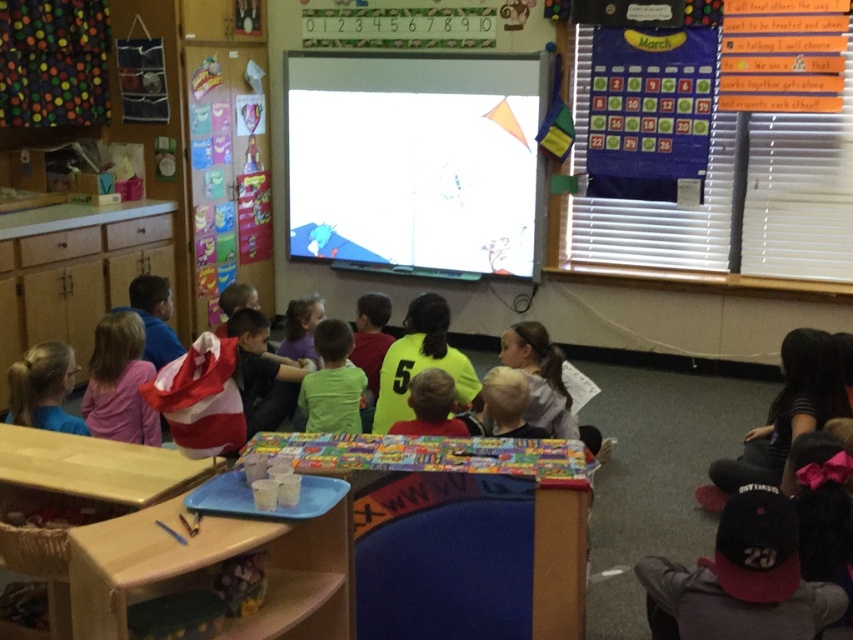
You are a student sitting at the desk in the front row. You need to look at the white glossy screen at upper center. Where should you look relative to the window on the right side of the image?

The white glossy screen at upper center is located to the left of the window on the right side of the image.

Based on the photo, you are a student sitting at the desk in the back row of the classroom. You want to look at the white glossy screen at upper center. Which direction should you turn your head to look at it?

The white glossy screen at upper center is located at point (415, 160), which is to the front of the classroom. Since you are sitting in the back row, you would need to look forward to see it.

You are a student sitting at the desk and looking at the white glossy screen at upper center and the black fabric at lower right. Which object is closer to you?

The white glossy screen at upper center is closer to you because it is further to the viewer than the black fabric at lower right, meaning it appears nearer in the visual perspective.